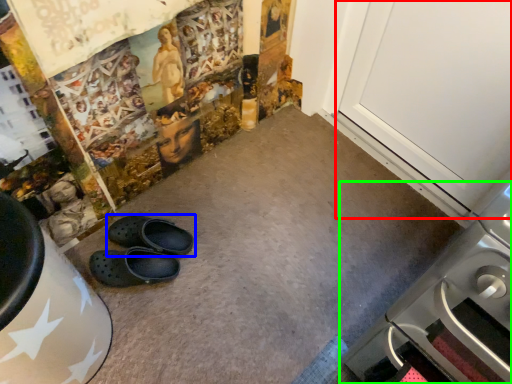
Question: Which object is positioned closest to door (highlighted by a red box)? Select from footwear (highlighted by a blue box) and home appliance (highlighted by a green box).

Choices:
 (A) footwear
 (B) home appliance

Answer: (B)